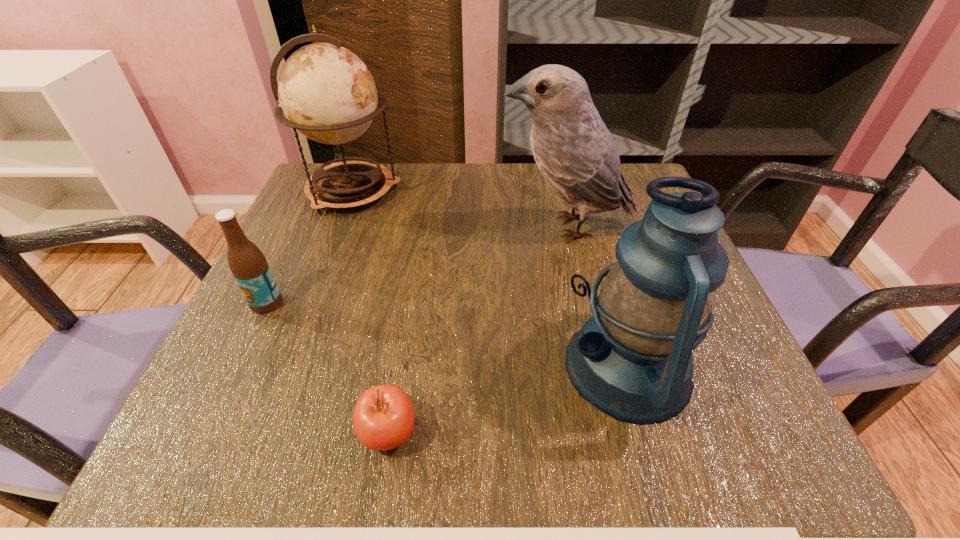
In the image, there is a desktop. At what (x,y) coordinates should I click in order to perform the action: click on blank space at the near left corner. Please return your answer as a coordinate pair (x, y). This screenshot has width=960, height=540. Looking at the image, I should click on (289, 450).

In order to click on vacant area at the far right corner of the desktop in this screenshot , I will do `click(646, 188)`.

The height and width of the screenshot is (540, 960). What are the coordinates of `empty space between the globe and the parrot` in the screenshot? It's located at (460, 209).

Identify the location of free spot between the lantern and the shortest object. (508, 400).

Locate an element on the screen. The width and height of the screenshot is (960, 540). free spot between the third object from left to right and the parrot is located at coordinates (477, 330).

Where is `free spot between the beer bottle and the apple`? free spot between the beer bottle and the apple is located at coordinates click(x=327, y=368).

Identify the location of empty space that is in between the globe and the apple. (371, 312).

The width and height of the screenshot is (960, 540). What are the coordinates of `free spot between the globe and the lantern` in the screenshot? It's located at click(x=491, y=279).

Identify the location of unoccupied position between the globe and the lantern. (491, 279).

Locate an element on the screen. This screenshot has height=540, width=960. free space between the apple and the lantern is located at coordinates (508, 400).